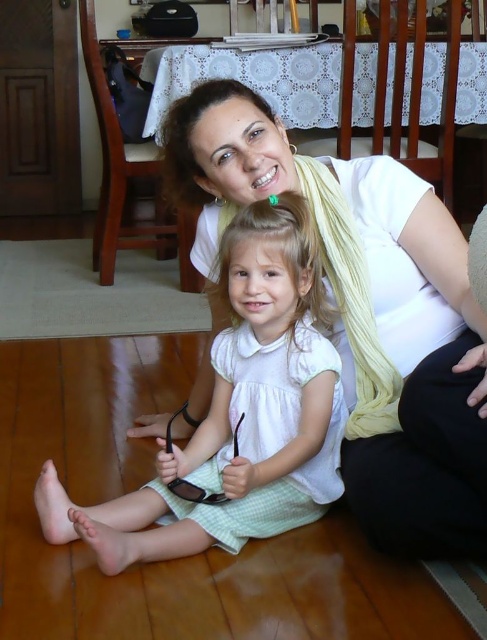
Question: Is white matte scarf at upper center to the left of white cotton dress at center from the viewer's perspective?

Choices:
 (A) no
 (B) yes

Answer: (A)

Question: Which object appears farthest from the camera in this image?

Choices:
 (A) white cotton dress at center
 (B) white matte scarf at upper center

Answer: (A)

Question: Does white matte scarf at upper center appear on the right side of white cotton dress at center?

Choices:
 (A) no
 (B) yes

Answer: (B)

Question: Does white matte scarf at upper center have a greater width compared to white cotton dress at center?

Choices:
 (A) no
 (B) yes

Answer: (B)

Question: Which object appears farthest from the camera in this image?

Choices:
 (A) white matte scarf at upper center
 (B) white cotton dress at center

Answer: (B)